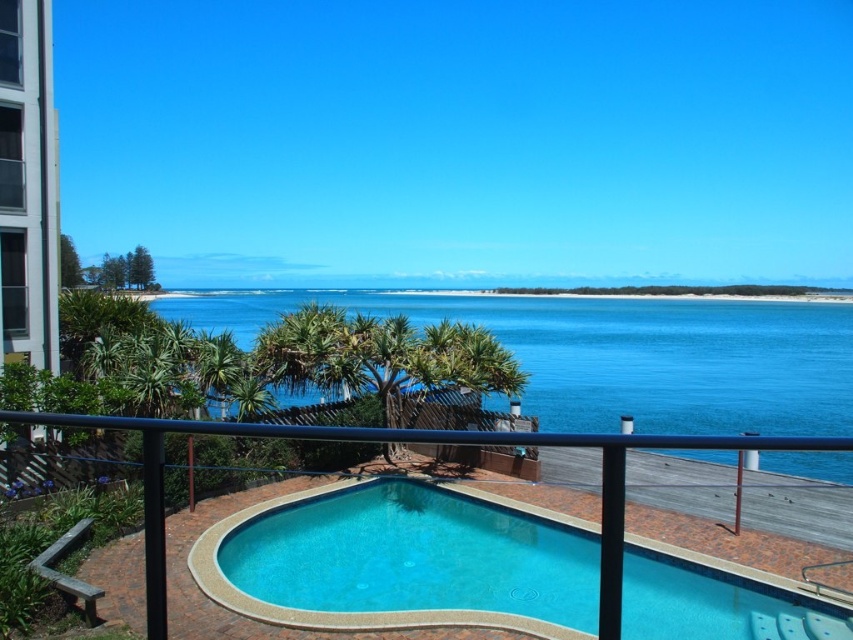
You are standing on the balcony and want to locate the smooth concrete pool at center. According to the coordinates provided, where would you look?

The smooth concrete pool at center is located at coordinates point (x=402, y=561).

You are standing on the balcony and want to get a closer look at the smooth concrete pool at center and the blue water at center. Which one can you reach without crossing the black metal railing?

The smooth concrete pool at center is closer to you than the blue water at center, so you can reach the smooth concrete pool at center without crossing the black metal railing, but the blue water at center is farther away and requires crossing the railing to access.

You are designing a layout for a new pool area and want to ensure the smooth concrete pool at center and the blue water at center are proportionally balanced. Based on the scene, which object takes up more area in the image?

The blue water at center occupies more area than the smooth concrete pool at center according to the description.